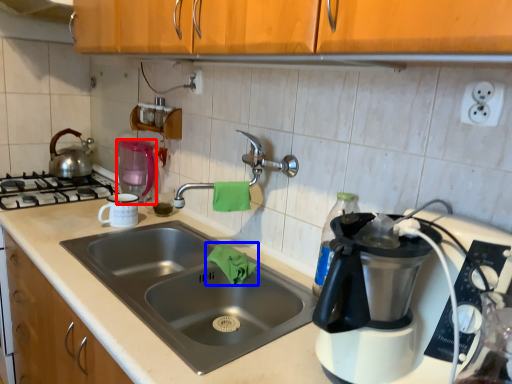
Question: Which point is closer to the camera, kitchen appliance (highlighted by a red box) or material (highlighted by a blue box)?

Choices:
 (A) kitchen appliance
 (B) material

Answer: (B)